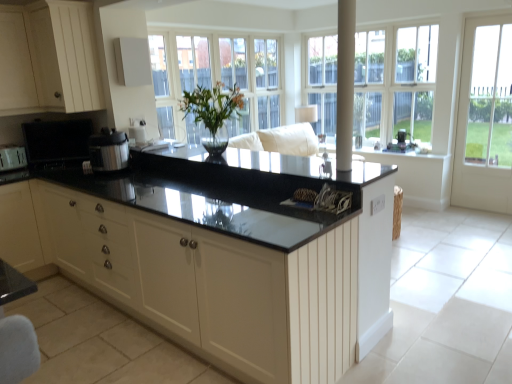
The image size is (512, 384). Identify the location of free space in front of white glossy pole at center. (353, 184).